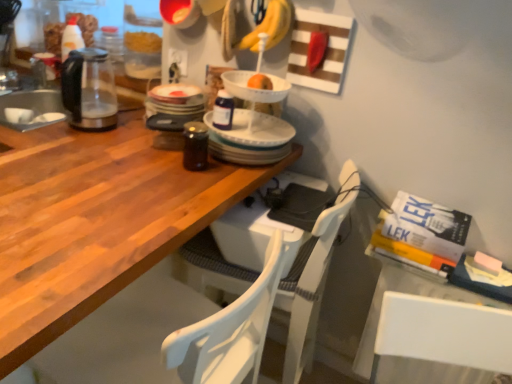
Question: Based on their sizes in the image, would you say white plastic chair at center, acting as the second chair starting from the front, is bigger or smaller than transparent glass kettle at left?

Choices:
 (A) small
 (B) big

Answer: (B)

Question: From the image's perspective, is white plastic chair at center, acting as the second chair starting from the front, located above or below transparent glass kettle at left?

Choices:
 (A) above
 (B) below

Answer: (B)

Question: Which is nearer to the wooden table at center?

Choices:
 (A) transparent glass kettle at left
 (B) white plastic chair at center, acting as the second chair starting from the front
 (C) white wood chair at lower left, the 1th chair in the front-to-back sequence
 (D) yellow matte bananas at upper center

Answer: (C)

Question: Estimate the real-world distances between objects in this image. Which object is farther from the white plastic chair at center, acting as the second chair starting from the front?

Choices:
 (A) white wood chair at lower left, acting as the second chair starting from the back
 (B) transparent glass kettle at left
 (C) wooden table at center
 (D) yellow matte bananas at upper center

Answer: (B)